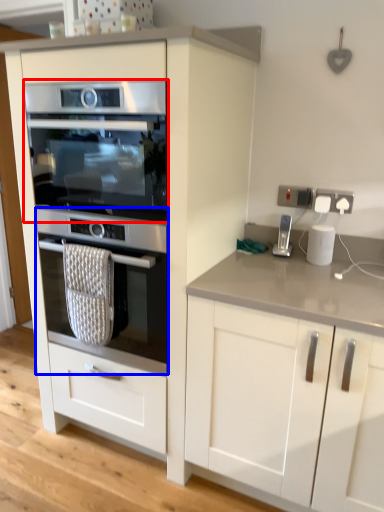
Question: Which object is closer to the camera taking this photo, oven (highlighted by a red box) or oven (highlighted by a blue box)?

Choices:
 (A) oven
 (B) oven

Answer: (A)